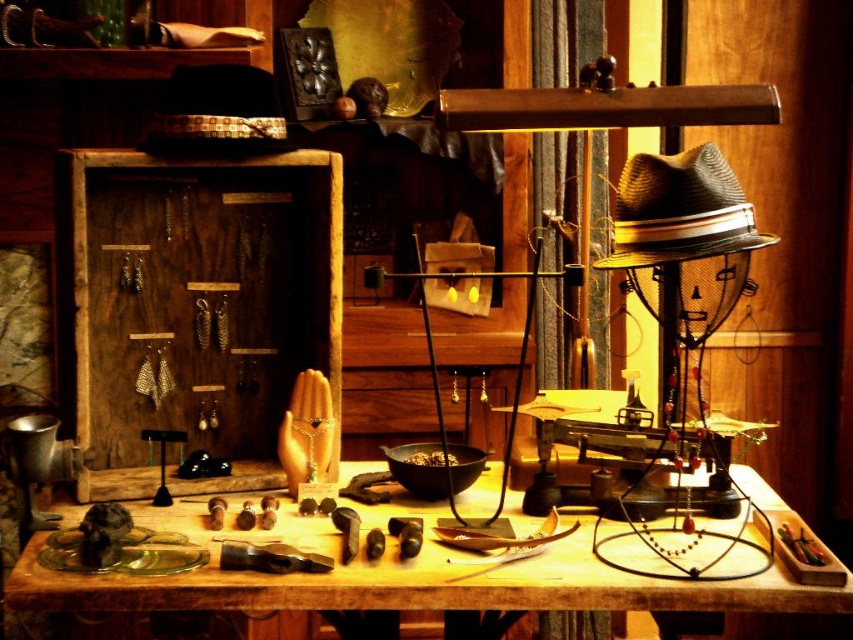
Is wooden jewelry display at upper left positioned in front of wooden table at center?

No, it is not.

Is point (189, 212) behind point (85, 596)?

Yes, point (189, 212) is farther from viewer.

Which is behind, point (132, 372) or point (511, 504)?

Positioned behind is point (132, 372).

At what (x,y) coordinates should I click in order to perform the action: click on wooden jewelry display at upper left. Please return your answer as a coordinate pair (x, y). The image size is (853, 640). Looking at the image, I should click on coord(199,308).

Does wooden jewelry display at upper left have a greater width compared to woven straw cowboy hat at upper right?

Correct, the width of wooden jewelry display at upper left exceeds that of woven straw cowboy hat at upper right.

Is wooden jewelry display at upper left to the left of woven straw cowboy hat at upper right from the viewer's perspective?

Indeed, wooden jewelry display at upper left is positioned on the left side of woven straw cowboy hat at upper right.

Does point (88, 164) come farther from viewer compared to point (706, 145)?

Yes, point (88, 164) is behind point (706, 145).

Find the location of `wooden jewelry display at upper left`. wooden jewelry display at upper left is located at coordinates (199, 308).

Between point (403, 506) and point (636, 220), which one is positioned behind?

Positioned behind is point (403, 506).

Does wooden table at center have a larger size compared to woven straw cowboy hat at upper right?

Yes.

This screenshot has height=640, width=853. What do you see at coordinates (408, 580) in the screenshot? I see `wooden table at center` at bounding box center [408, 580].

Locate an element on the screen. The image size is (853, 640). wooden table at center is located at coordinates (408, 580).